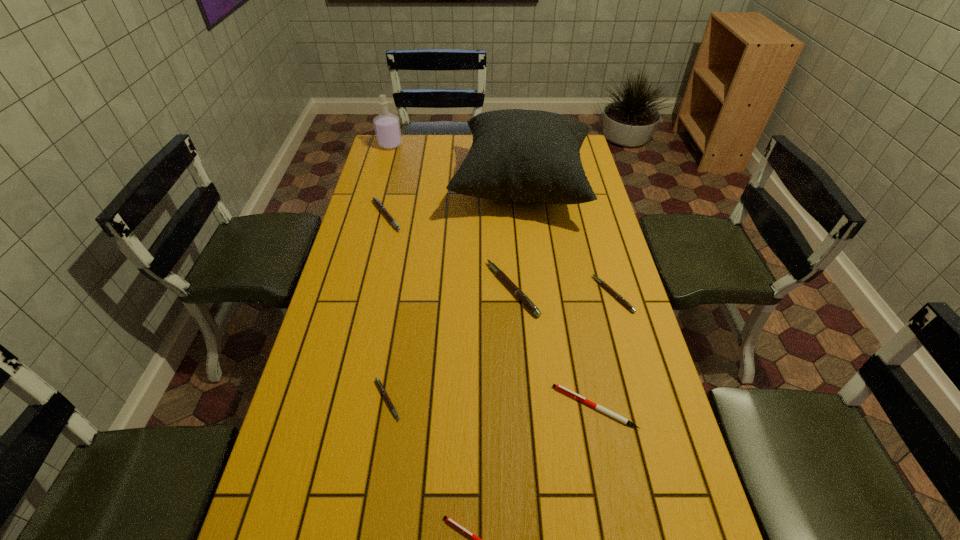
This screenshot has width=960, height=540. I want to click on cushion positioned at the right edge, so click(x=530, y=156).

This screenshot has width=960, height=540. I want to click on object located at the far left corner, so click(x=387, y=126).

Locate an element on the screen. The width and height of the screenshot is (960, 540). object that is at the far right corner is located at coordinates (530, 156).

In the image, there is a desktop. What are the coordinates of `vacant space at the far edge` in the screenshot? It's located at (455, 151).

You are a GUI agent. You are given a task and a screenshot of the screen. Output one action in this format:
    pyautogui.click(x=<x>, y=<y>)
    Task: Click on the vacant point at the left edge
    
    Given the screenshot: What is the action you would take?
    pyautogui.click(x=399, y=211)

Identify the location of vacant space at the right edge of the desktop. This screenshot has width=960, height=540. (588, 335).

Locate an element on the screen. This screenshot has width=960, height=540. empty location between the fifth pen from right to left and the rightmost pink pen is located at coordinates (500, 347).

The image size is (960, 540). In order to click on free space between the cushion and the third smallest pink pen in this screenshot , I will do `click(454, 201)`.

Where is `the third closest object to the tallest object`? The width and height of the screenshot is (960, 540). the third closest object to the tallest object is located at coordinates (607, 287).

Identify which object is the third closest to the third tallest object. Please provide its 2D coordinates. Your answer should be formatted as a tuple, i.e. [(x, y)], where the tuple contains the x and y coordinates of a point satisfying the conditions above.

[(558, 387)]